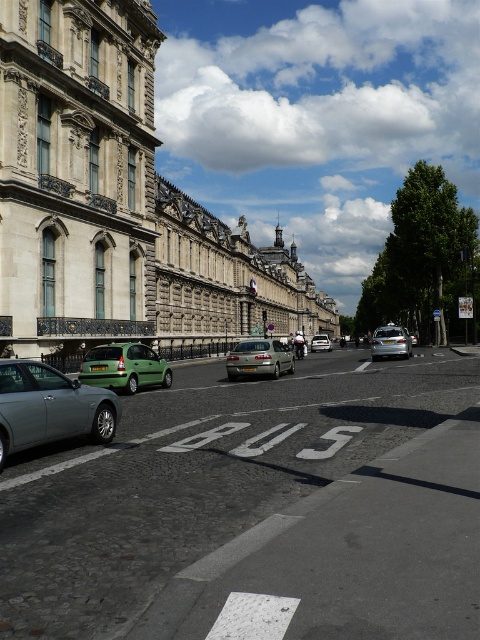
Can you confirm if green matte hatchback at center is taller than satin silver sedan at center?

In fact, green matte hatchback at center may be shorter than satin silver sedan at center.

Is green matte hatchback at center closer to camera compared to satin silver sedan at center?

Yes, green matte hatchback at center is in front of satin silver sedan at center.

Is point (93, 358) closer to viewer compared to point (231, 372)?

Yes, point (93, 358) is in front of point (231, 372).

This screenshot has width=480, height=640. I want to click on green matte hatchback at center, so click(x=123, y=368).

Can you confirm if beige stone building at upper center is smaller than silver metallic car at lower left?

No, beige stone building at upper center is not smaller than silver metallic car at lower left.

Describe the element at coordinates (117, 202) in the screenshot. I see `beige stone building at upper center` at that location.

At what (x,y) coordinates should I click in order to perform the action: click on beige stone building at upper center. Please return your answer as a coordinate pair (x, y). This screenshot has width=480, height=640. Looking at the image, I should click on (117, 202).

Is beige stone building at upper center thinner than silver metallic sedan at center?

In fact, beige stone building at upper center might be wider than silver metallic sedan at center.

Can you confirm if beige stone building at upper center is positioned below silver metallic sedan at center?

No.

At what (x,y) coordinates should I click in order to perform the action: click on beige stone building at upper center. Please return your answer as a coordinate pair (x, y). This screenshot has width=480, height=640. Looking at the image, I should click on (117, 202).